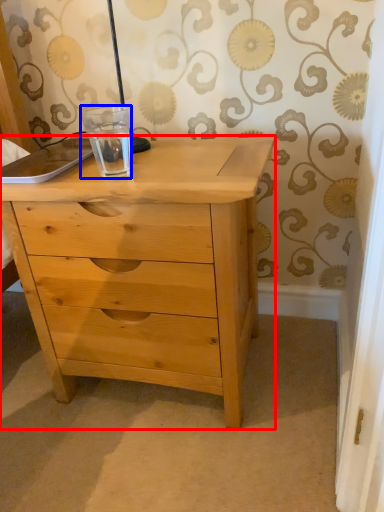
Question: Which object is closer to the camera taking this photo, chest of drawers (highlighted by a red box) or glass jar (highlighted by a blue box)?

Choices:
 (A) chest of drawers
 (B) glass jar

Answer: (A)